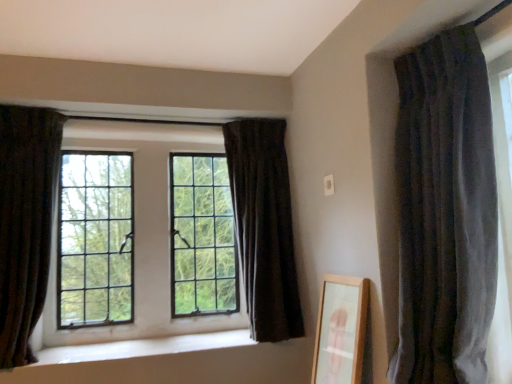
Question: Is dark velvet curtain at left, which ranks as the 1th curtain in left-to-right order, not close to velvet dark gray curtain at right, the third curtain from the left?

Choices:
 (A) no
 (B) yes

Answer: (B)

Question: Is dark velvet curtain at left, arranged as the 3th curtain when viewed from the right, placed right next to velvet dark gray curtain at right, the first curtain from the right?

Choices:
 (A) yes
 (B) no

Answer: (B)

Question: From a real-world perspective, does dark velvet curtain at left, arranged as the 3th curtain when viewed from the right, stand above velvet dark gray curtain at right, which is counted as the third curtain, starting from the back?

Choices:
 (A) no
 (B) yes

Answer: (B)

Question: Is dark velvet curtain at left, arranged as the 3th curtain when viewed from the right, not inside velvet dark gray curtain at right, the first curtain from the right?

Choices:
 (A) no
 (B) yes

Answer: (B)

Question: Does dark velvet curtain at left, which is the second curtain in back-to-front order, appear on the left side of velvet dark gray curtain at right, acting as the first curtain starting from the front?

Choices:
 (A) no
 (B) yes

Answer: (B)

Question: Considering the relative positions of dark velvet curtain at left, arranged as the 3th curtain when viewed from the right, and velvet dark gray curtain at right, acting as the first curtain starting from the front, in the image provided, is dark velvet curtain at left, arranged as the 3th curtain when viewed from the right, to the right of velvet dark gray curtain at right, acting as the first curtain starting from the front, from the viewer's perspective?

Choices:
 (A) no
 (B) yes

Answer: (A)

Question: Is white smooth window sill at center at the left side of velvet dark gray curtain at right, the first curtain from the right?

Choices:
 (A) yes
 (B) no

Answer: (A)

Question: Is white smooth window sill at center smaller than velvet dark gray curtain at right, the third curtain from the left?

Choices:
 (A) yes
 (B) no

Answer: (A)

Question: Does white smooth window sill at center have a greater width compared to velvet dark gray curtain at right, acting as the first curtain starting from the front?

Choices:
 (A) yes
 (B) no

Answer: (A)

Question: Can you confirm if white smooth window sill at center is positioned to the right of velvet dark gray curtain at right, the first curtain from the right?

Choices:
 (A) yes
 (B) no

Answer: (B)

Question: Is white smooth window sill at center shorter than velvet dark gray curtain at right, which is counted as the third curtain, starting from the back?

Choices:
 (A) no
 (B) yes

Answer: (B)

Question: Does white smooth window sill at center lie in front of velvet dark gray curtain at right, acting as the first curtain starting from the front?

Choices:
 (A) yes
 (B) no

Answer: (B)

Question: Is velvet dark gray curtain at right, the third curtain from the left, taller than dark velvet curtain at left, arranged as the 3th curtain when viewed from the right?

Choices:
 (A) yes
 (B) no

Answer: (A)